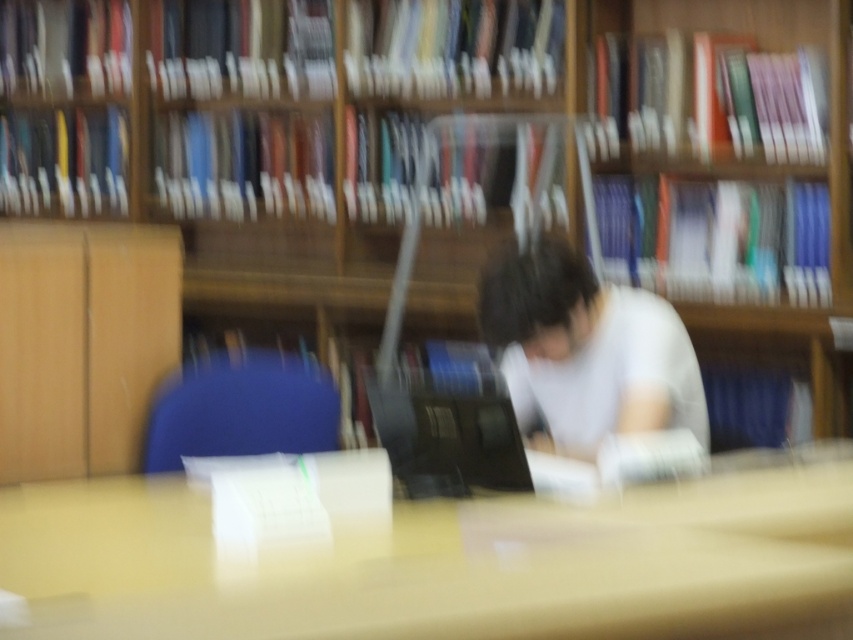
Question: Which of the following is the closest to the observer?

Choices:
 (A) (749, 497)
 (B) (633, 323)

Answer: (A)

Question: Does smooth wooden table at center have a larger size compared to white matte shirt at center?

Choices:
 (A) yes
 (B) no

Answer: (A)

Question: Is smooth wooden table at center smaller than white matte shirt at center?

Choices:
 (A) yes
 (B) no

Answer: (B)

Question: Can you confirm if smooth wooden table at center is positioned below white matte shirt at center?

Choices:
 (A) yes
 (B) no

Answer: (A)

Question: Which object appears closest to the camera in this image?

Choices:
 (A) smooth wooden table at center
 (B) white matte shirt at center

Answer: (A)